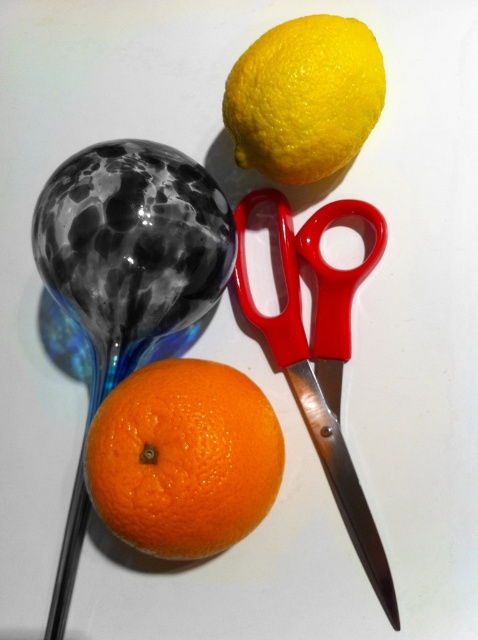
Can you confirm if yellow matte lemon at upper center is taller than red metallic scissors at center?

No.

Between yellow matte lemon at upper center and red metallic scissors at center, which one appears on the left side from the viewer's perspective?

yellow matte lemon at upper center

This screenshot has width=478, height=640. What do you see at coordinates (304, 97) in the screenshot?
I see `yellow matte lemon at upper center` at bounding box center [304, 97].

Image resolution: width=478 pixels, height=640 pixels. Identify the location of yellow matte lemon at upper center. (x=304, y=97).

Can you confirm if orangesmoothorange at center is positioned below red metallic scissors at center?

Yes.

Between orangesmoothorange at center and red metallic scissors at center, which one appears on the right side from the viewer's perspective?

red metallic scissors at center

You are a GUI agent. You are given a task and a screenshot of the screen. Output one action in this format:
    pyautogui.click(x=<x>, y=<y>)
    Task: Click on the orangesmoothorange at center
    The image size is (478, 640).
    Given the screenshot: What is the action you would take?
    pyautogui.click(x=184, y=458)

The height and width of the screenshot is (640, 478). What do you see at coordinates (184, 458) in the screenshot? I see `orangesmoothorange at center` at bounding box center [184, 458].

In the scene shown: Does orangesmoothorange at center have a smaller size compared to yellow matte lemon at upper center?

Actually, orangesmoothorange at center might be larger than yellow matte lemon at upper center.

Describe the element at coordinates (184, 458) in the screenshot. This screenshot has width=478, height=640. I see `orangesmoothorange at center` at that location.

Where is `orangesmoothorange at center`? orangesmoothorange at center is located at coordinates (184, 458).